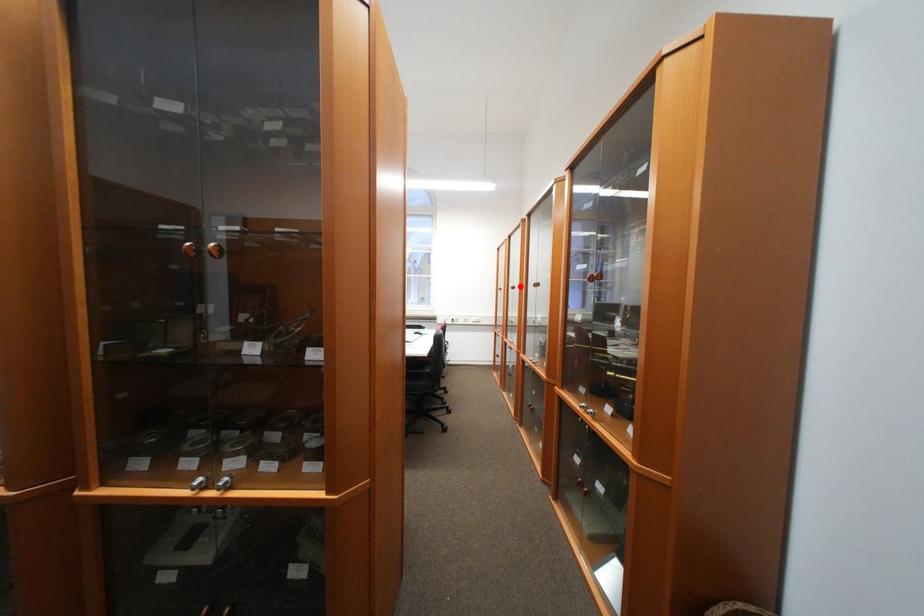
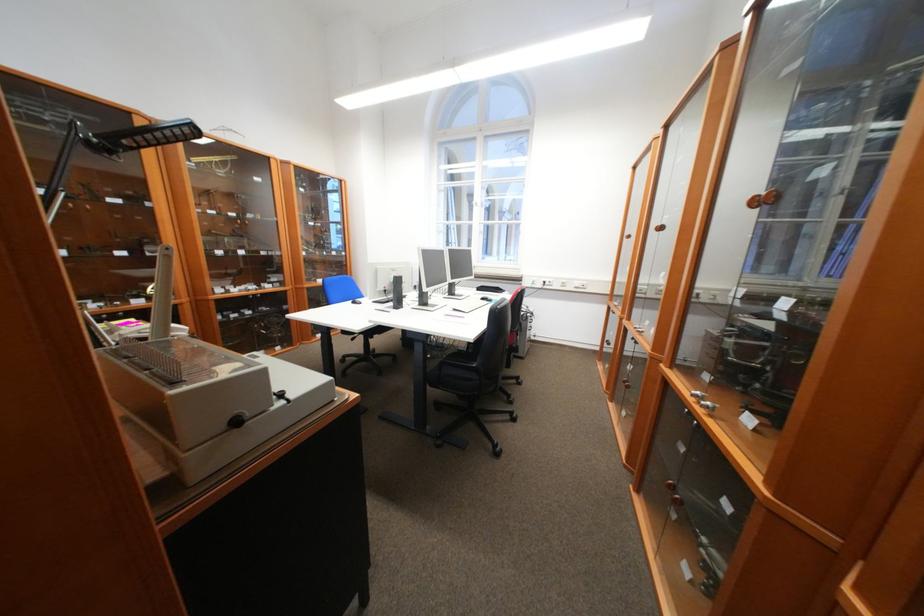
Where in the second image is the point corresponding to the highlighted location from the first image?

(663, 225)